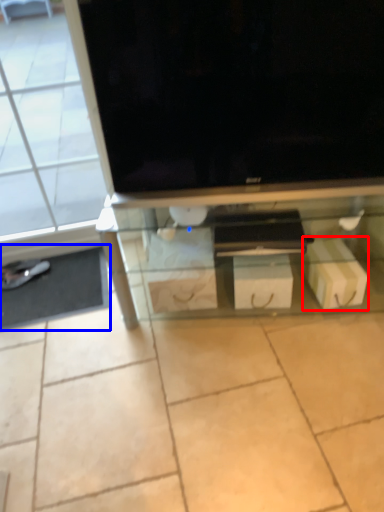
Question: Which point is further to the camera, cardboard box (highlighted by a red box) or flat (highlighted by a blue box)?

Choices:
 (A) cardboard box
 (B) flat

Answer: (B)